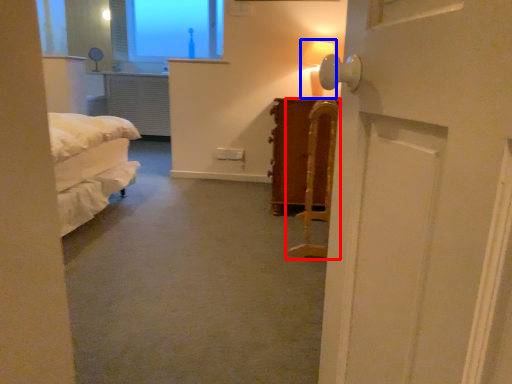
Question: Among these objects, which one is farthest to the camera, furniture (highlighted by a red box) or table lamp (highlighted by a blue box)?

Choices:
 (A) furniture
 (B) table lamp

Answer: (B)